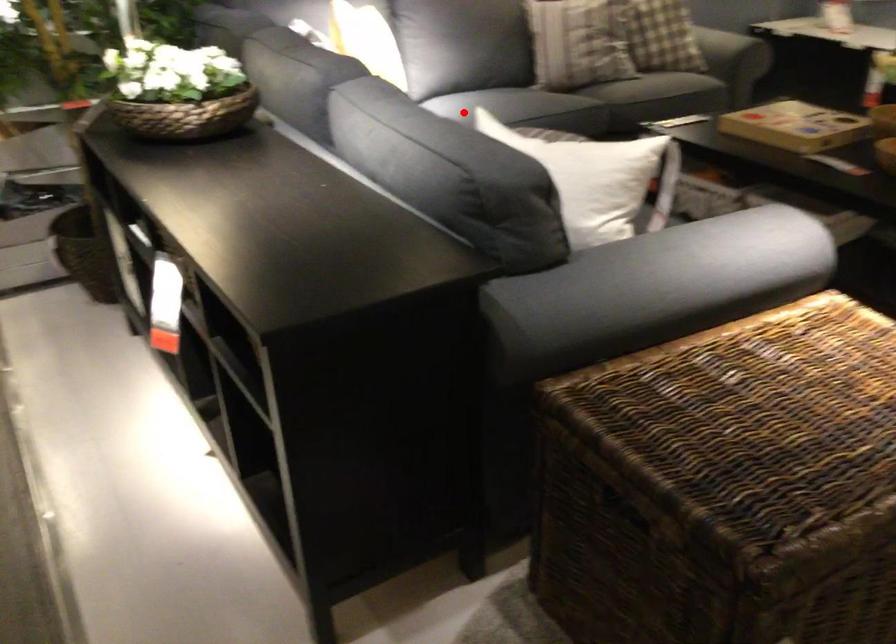
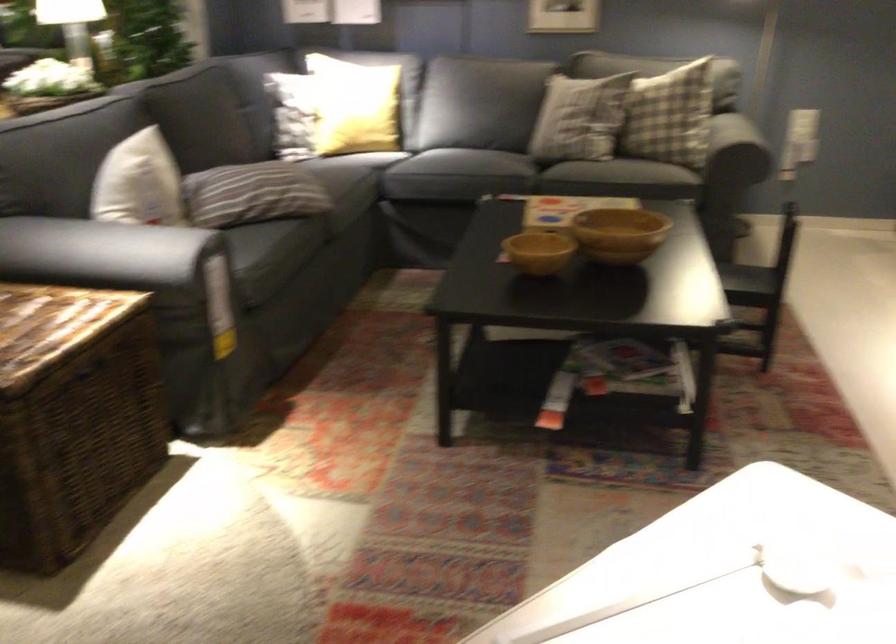
Locate, in the second image, the point that corresponds to the highlighted location in the first image.

(386, 149)